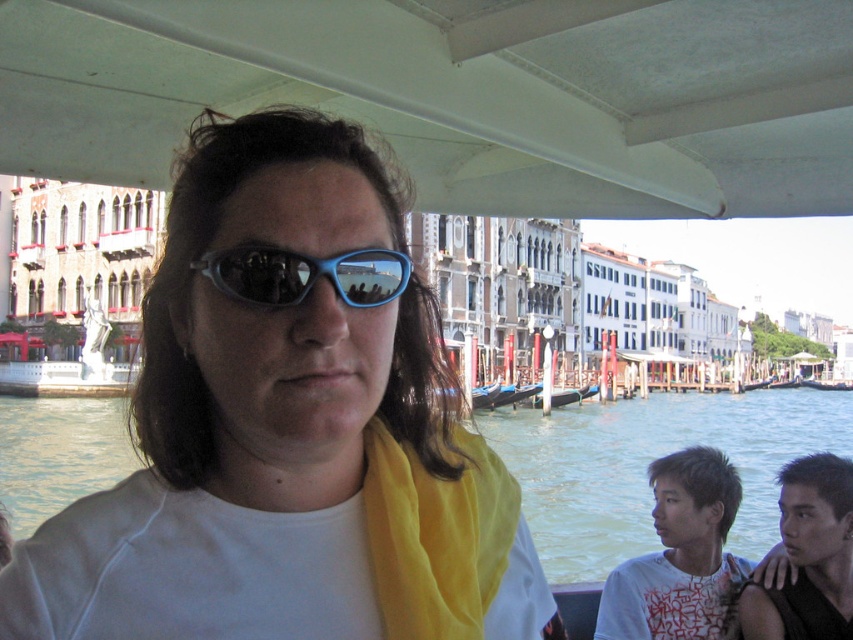
Between point (223, 384) and point (265, 304), which one is positioned behind?

Positioned behind is point (223, 384).

Locate an element on the screen. The image size is (853, 640). white matte sunglasses at center is located at coordinates (254, 404).

Is clear water at center above blue plastic goggles at center?

Actually, clear water at center is below blue plastic goggles at center.

Find the location of a particular element. This screenshot has height=640, width=853. clear water at center is located at coordinates (647, 464).

Looking at this image, between white matte sunglasses at center and clear water at center, which one appears on the left side from the viewer's perspective?

white matte sunglasses at center

Does white matte sunglasses at center have a lesser width compared to clear water at center?

Yes, white matte sunglasses at center is thinner than clear water at center.

Where is `white matte sunglasses at center`? white matte sunglasses at center is located at coordinates tap(254, 404).